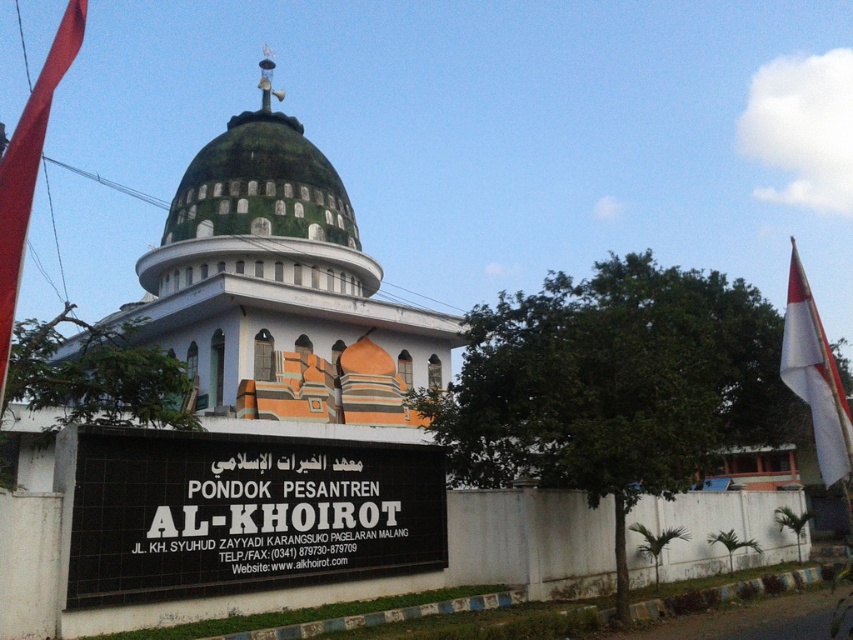
You are standing in front of the mosque and want to place a new decorative item between the black plastic sign at center and the red fabric flag at left. The item is 2 meters long. Will there be enough space between them to place it without moving either object?

The black plastic sign at center and red fabric flag at left are 19.90 meters apart from each other. Since the decorative item is only 2 meters long, there is sufficient space between them to place it without moving either object.

You are a visitor approaching the mosque and want to take a photo of the green matte dome at center and the white fabric flag at right. Which object should you focus on first to ensure both are in frame?

The white fabric flag at right is larger than the green matte dome at center, so you should focus on the white fabric flag at right first to ensure both fit within the frame.

You are a visitor at the mosque and want to take a photo of both the black plastic sign at center and the white fabric flag at right. Which object should you zoom in on first to ensure both are in frame?

The black plastic sign at center has a smaller width compared to the white fabric flag at right. Therefore, you should first zoom in on the white fabric flag at right to accommodate its larger size while ensuring the black plastic sign at center remains in frame.